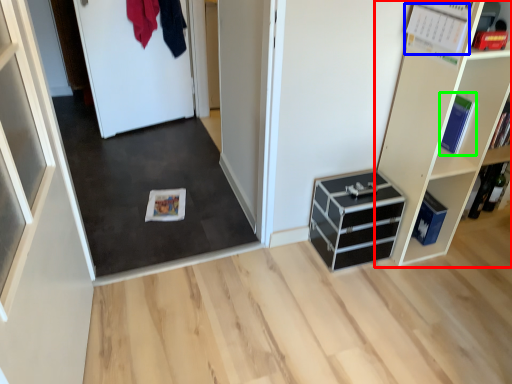
Question: Estimate the real-world distances between objects in this image. Which object is farther from shelf (highlighted by a red box), book (highlighted by a blue box) or book (highlighted by a green box)?

Choices:
 (A) book
 (B) book

Answer: (A)